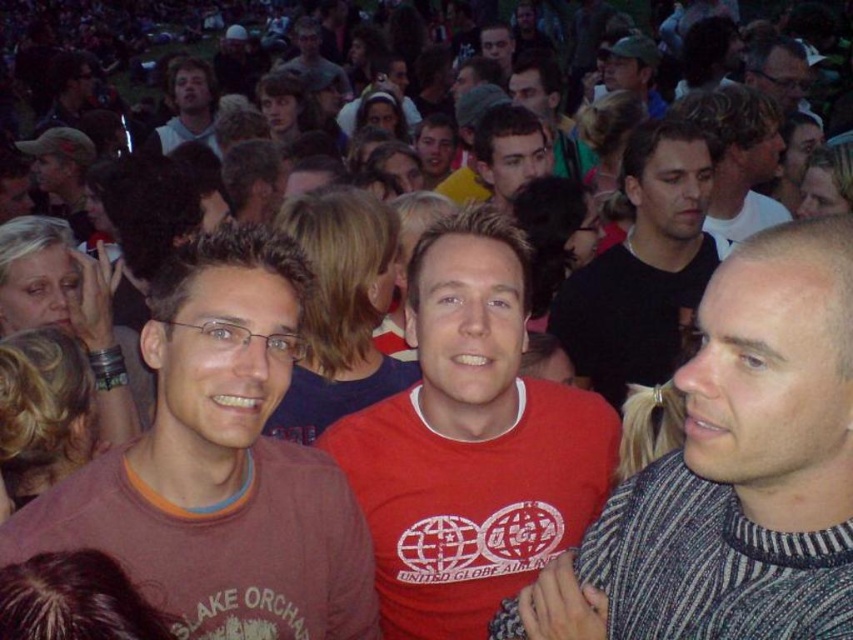
Is red cotton t-shirt at center closer to the viewer compared to matte black shirt at upper right?

Yes, it is.

Find the location of a particular element. red cotton t-shirt at center is located at coordinates (471, 442).

Does point (410, 412) come in front of point (706, 134)?

Yes, point (410, 412) is closer to viewer.

The image size is (853, 640). In order to click on red cotton t-shirt at center in this screenshot , I will do `click(471, 442)`.

Does matte brown t-shirt at center have a greater width compared to matte black shirt at upper right?

Yes.

Does matte brown t-shirt at center have a lesser width compared to matte black shirt at upper right?

No.

You are a GUI agent. You are given a task and a screenshot of the screen. Output one action in this format:
    pyautogui.click(x=<x>, y=<y>)
    Task: Click on the matte brown t-shirt at center
    Image resolution: width=853 pixels, height=640 pixels.
    Given the screenshot: What is the action you would take?
    pyautogui.click(x=219, y=465)

Which is in front, point (572, 518) or point (149, 140)?

Point (572, 518)

Does red cotton t-shirt at center have a smaller size compared to light brown hair at upper left?

Correct, red cotton t-shirt at center occupies less space than light brown hair at upper left.

Measure the distance between point (457,467) and camera.

4.08 meters

Where is `red cotton t-shirt at center`? red cotton t-shirt at center is located at coordinates (471, 442).